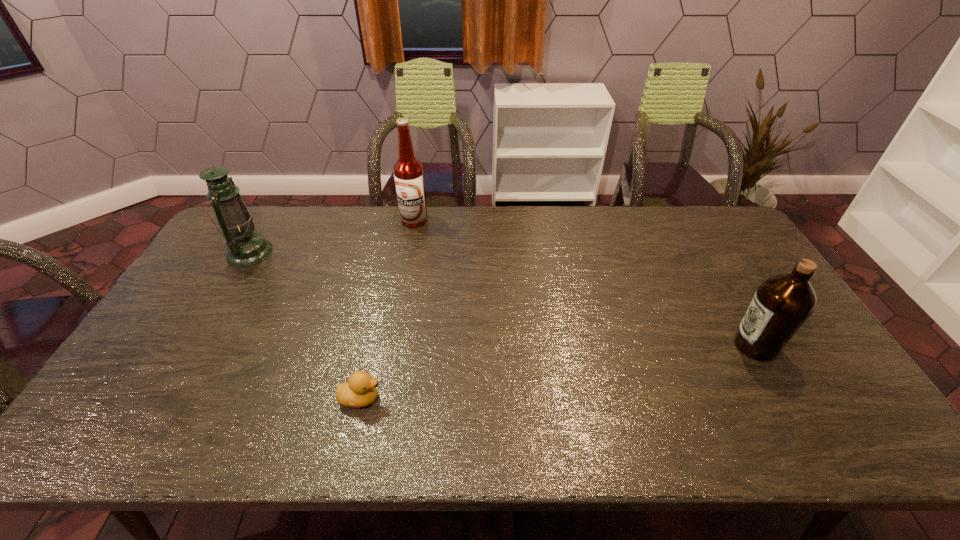
In the image, there is a desktop. What are the coordinates of `vacant space at the left edge` in the screenshot? It's located at (160, 341).

Identify the location of vacant area at the right edge of the desktop. (755, 265).

Image resolution: width=960 pixels, height=540 pixels. Find the location of `vacant space that's between the nearest object and the alcohol`. vacant space that's between the nearest object and the alcohol is located at coordinates (388, 309).

You are a GUI agent. You are given a task and a screenshot of the screen. Output one action in this format:
    pyautogui.click(x=<x>, y=<y>)
    Task: Click on the free space that is in between the duckling and the rightmost object
    
    Given the screenshot: What is the action you would take?
    pyautogui.click(x=558, y=372)

The width and height of the screenshot is (960, 540). I want to click on vacant space that is in between the nearest object and the oil lamp, so click(305, 325).

Find the location of a particular element. free point between the duckling and the leftmost object is located at coordinates (305, 325).

At what (x,y) coordinates should I click in order to perform the action: click on vacant area between the duckling and the farthest object. Please return your answer as a coordinate pair (x, y). Looking at the image, I should click on (388, 309).

Identify the location of vacant space that's between the nearest object and the alcohol. (388, 309).

I want to click on free space between the duckling and the alcohol, so [x=388, y=309].

In order to click on vacant space in between the alcohol and the shortest object in this screenshot , I will do `click(388, 309)`.